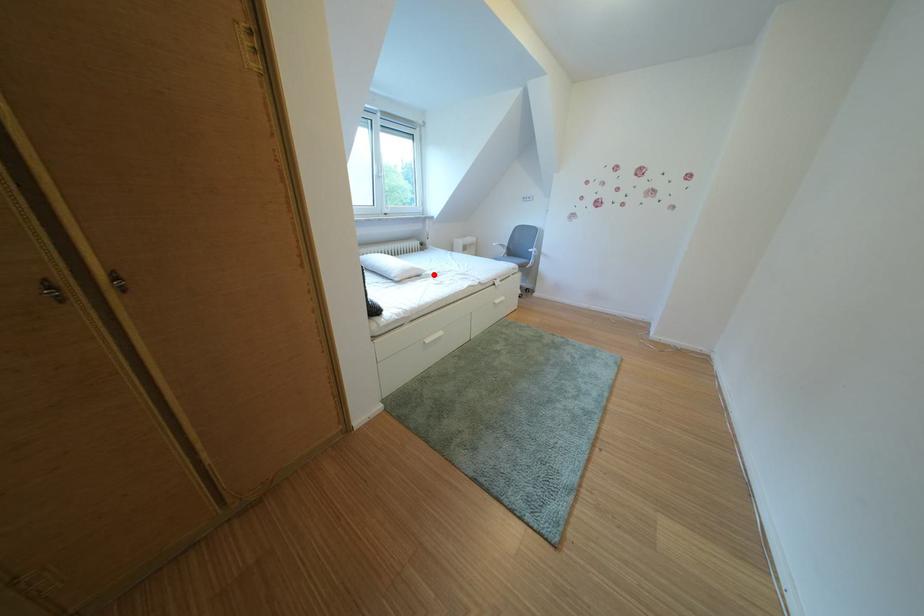
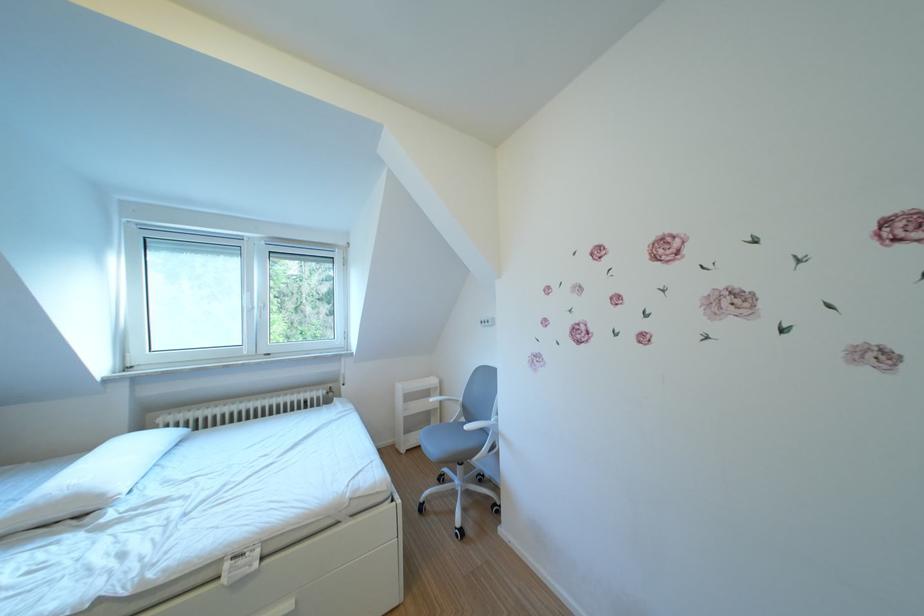
Find the pixel in the second image that matches the highlighted location in the first image.

(115, 501)